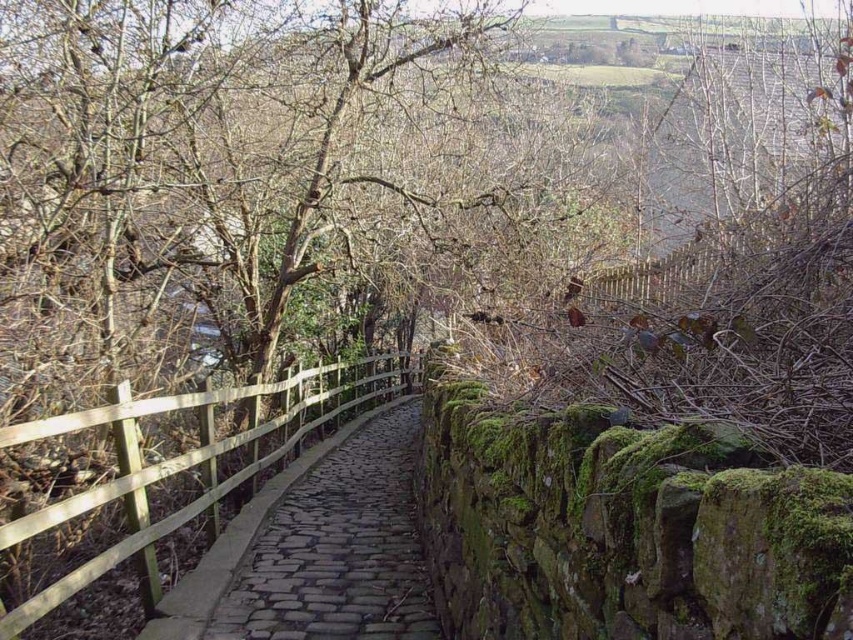
Question: Is cobblestone path at center smaller than wooden fence at center?

Choices:
 (A) no
 (B) yes

Answer: (B)

Question: Does cobblestone path at center appear under wooden fence at center?

Choices:
 (A) yes
 (B) no

Answer: (A)

Question: Does cobblestone path at center appear on the left side of wooden fence at center?

Choices:
 (A) no
 (B) yes

Answer: (A)

Question: Among these points, which one is farthest from the camera?

Choices:
 (A) click(x=407, y=544)
 (B) click(x=70, y=584)

Answer: (A)